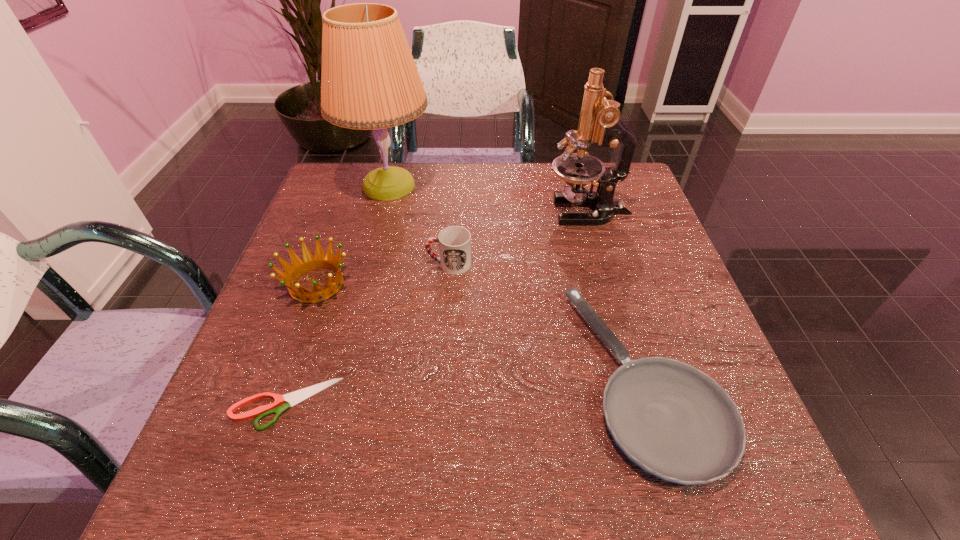
Identify the location of crown situated at the left edge. (319, 261).

Locate an element on the screen. scissors that is at the left edge is located at coordinates (296, 397).

What are the coordinates of `microscope present at the right edge` in the screenshot? It's located at (600, 122).

Locate an element on the screen. This screenshot has width=960, height=540. frying pan that is at the right edge is located at coordinates (675, 422).

Where is `object that is at the far left corner`? This screenshot has width=960, height=540. object that is at the far left corner is located at coordinates (369, 80).

The width and height of the screenshot is (960, 540). In order to click on object situated at the far right corner in this screenshot , I will do `click(600, 122)`.

Find the location of `object at the near right corner`. object at the near right corner is located at coordinates click(675, 422).

Where is `blank space at the far edge of the desktop`? This screenshot has width=960, height=540. blank space at the far edge of the desktop is located at coordinates (453, 193).

The width and height of the screenshot is (960, 540). In the image, there is a desktop. In order to click on vacant space at the near edge in this screenshot , I will do `click(395, 474)`.

Where is `vacant space at the left edge of the desktop`? vacant space at the left edge of the desktop is located at coordinates (218, 432).